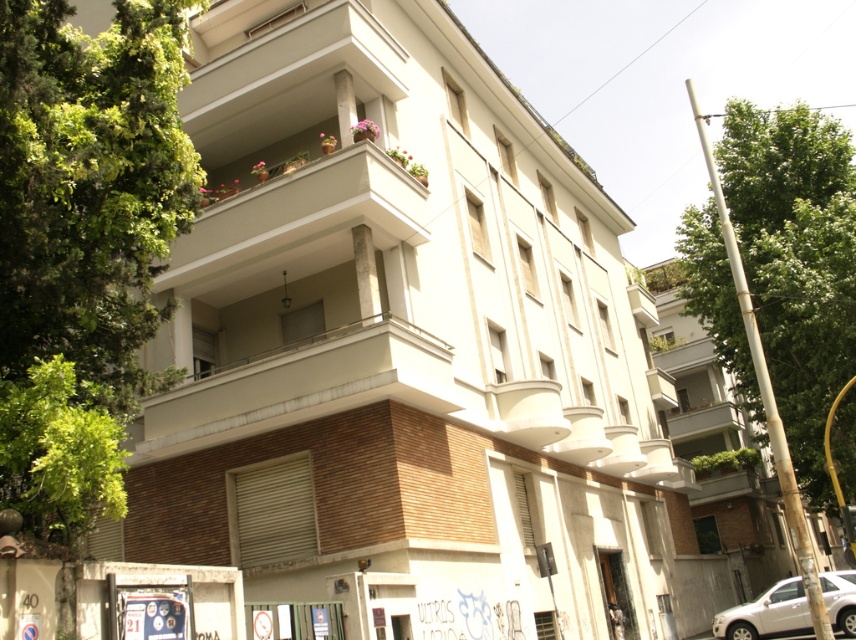
You are a delivery person trying to park your white matte car at lower right near the building. You notice a white concrete balcony at upper center. How does the height of the balcony compare to your car?

The white concrete balcony at upper center is much taller than the white matte car at lower right, so the balcony is significantly higher than the car.

You are a delivery person trying to park your white matte car at lower right near the entrance. The parking space available is exactly the same width as the white concrete balcony at upper center. Will your car fit in the parking space?

The white concrete balcony at upper center is wider than the white matte car at lower right, so the car will fit in the parking space since the space is as wide as the balcony, which is wider than the car.

You are standing at the entrance of the building and see two points marked on the ground. One is labeled as point (284, 260) and the other as point (800, 593). Which point is closer to you?

Point (284, 260) is in front of point (800, 593), so it is closer to you.